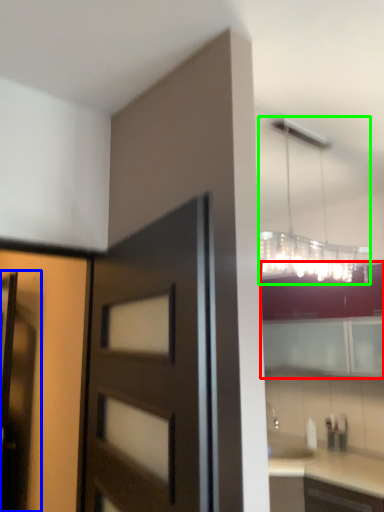
Question: Estimate the real-world distances between objects in this image. Which object is closer to cabinetry (highlighted by a red box), screen door (highlighted by a blue box) or lamp (highlighted by a green box)?

Choices:
 (A) screen door
 (B) lamp

Answer: (B)